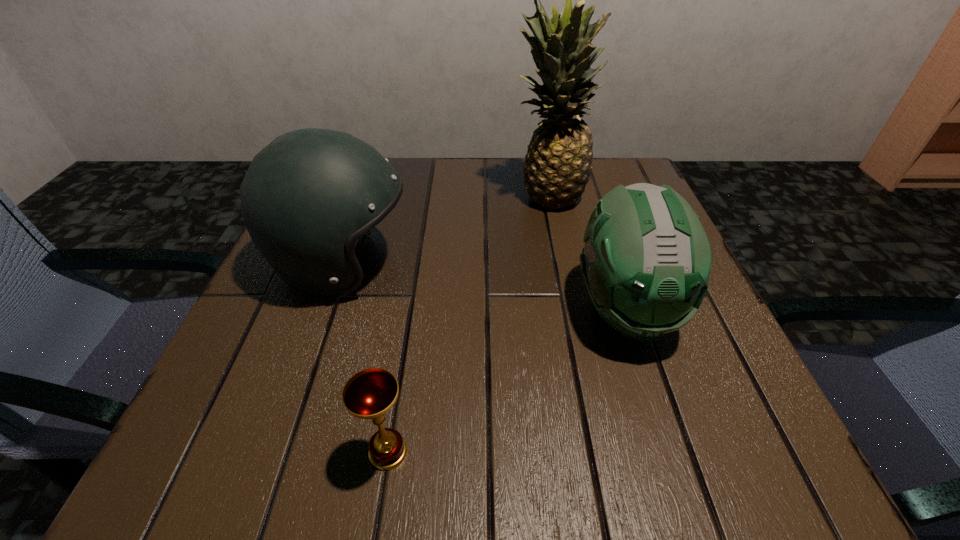
Locate an element on the screen. This screenshot has height=540, width=960. blank region between the chalice and the taller football helmet is located at coordinates 365,358.

The image size is (960, 540). I want to click on free space between the chalice and the tallest object, so click(x=468, y=324).

Choose which object is the second nearest neighbor to the tallest object. Please provide its 2D coordinates. Your answer should be formatted as a tuple, i.e. [(x, y)], where the tuple contains the x and y coordinates of a point satisfying the conditions above.

[(306, 197)]

Find the location of a particular element. The image size is (960, 540). object that is the second closest one to the shortest object is located at coordinates coord(646,262).

The width and height of the screenshot is (960, 540). Identify the location of vacant space that satisfies the following two spatial constraints: 1. at the face opening of the nearest object; 2. on the left side of the third shortest object. (277, 452).

You are a GUI agent. You are given a task and a screenshot of the screen. Output one action in this format:
    pyautogui.click(x=<x>, y=<y>)
    Task: Click on the vacant point that satisfies the following two spatial constraints: 1. at the face opening of the shortest object; 2. on the right side of the second tallest object
    This screenshot has width=960, height=540.
    Given the screenshot: What is the action you would take?
    pyautogui.click(x=277, y=452)